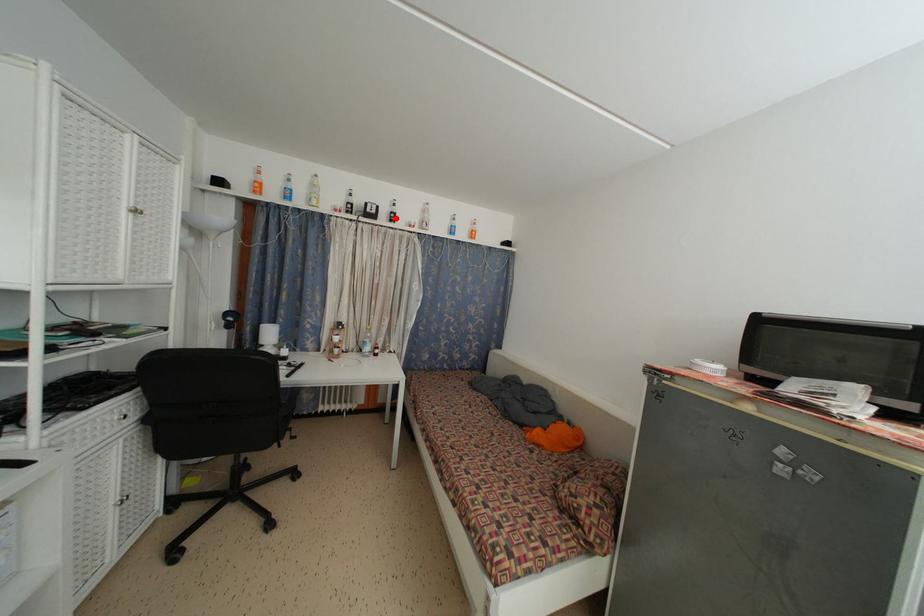
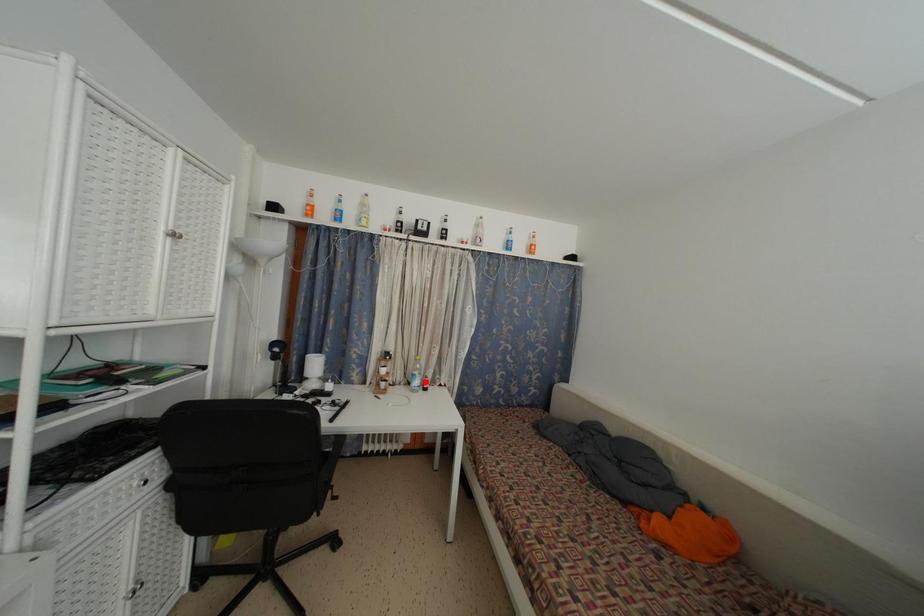
I am providing you with two images of the same scene from different viewpoints. A red point is marked on the first image and another point is marked on the second image. Is the red point in image1 aligned with the point shown in image2?

No